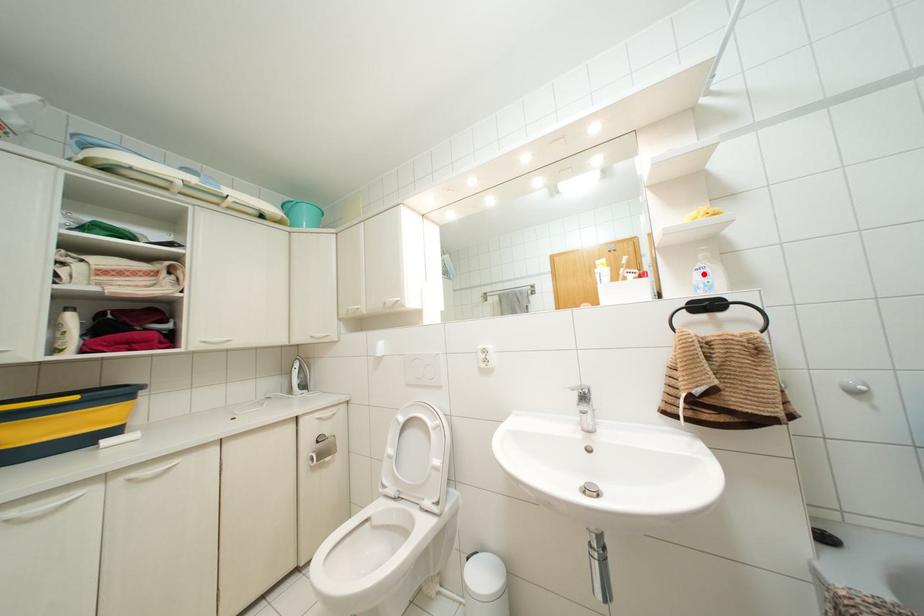
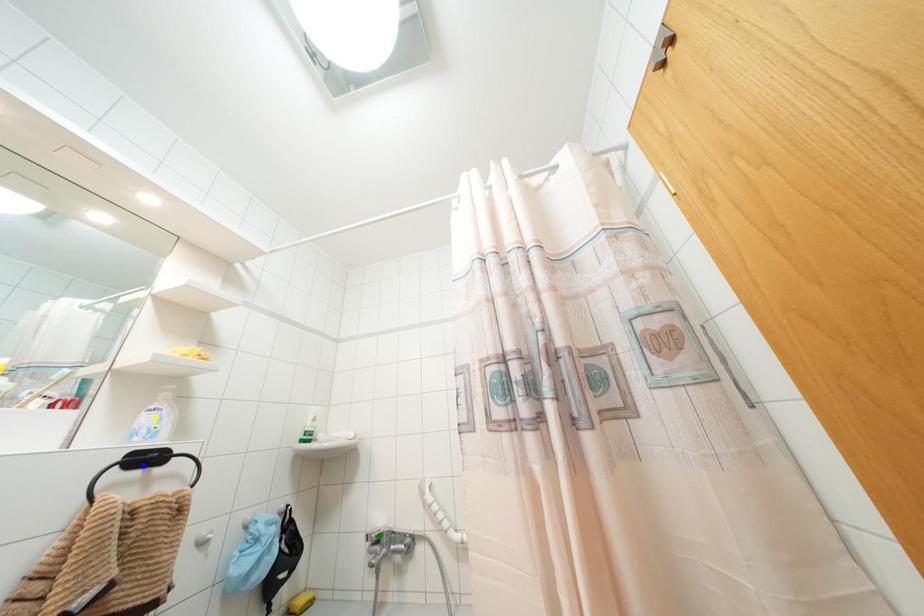
Question: I am providing you with two images of the same scene from different viewpoints. A red point is marked on the first image. You are given multiple points on the second image. Which spot in image 2 lines up with the point in image 1?

Choices:
 (A) yellow point
 (B) blue point
 (C) green point

Answer: (A)